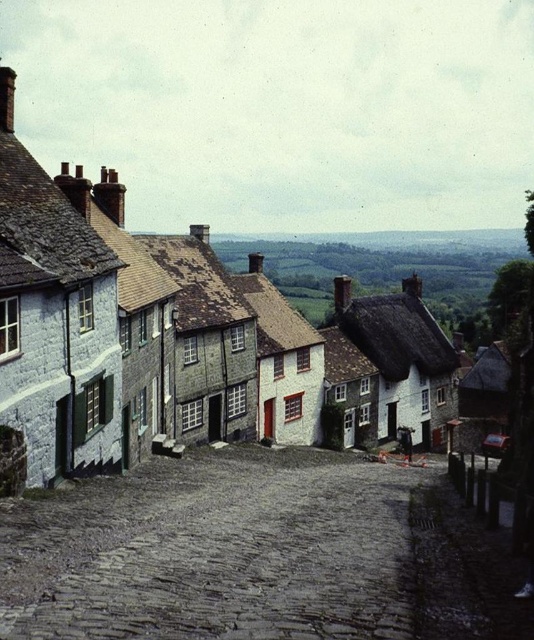
Can you confirm if gray cobblestone alley at center is shorter than white stone houses at center?

Correct, gray cobblestone alley at center is not as tall as white stone houses at center.

Does gray cobblestone alley at center have a greater width compared to white stone houses at center?

In fact, gray cobblestone alley at center might be narrower than white stone houses at center.

Who is more forward, [364,468] or [113,449]?

Positioned in front is point [113,449].

Where is `gray cobblestone alley at center`? Image resolution: width=534 pixels, height=640 pixels. gray cobblestone alley at center is located at coordinates (256, 556).